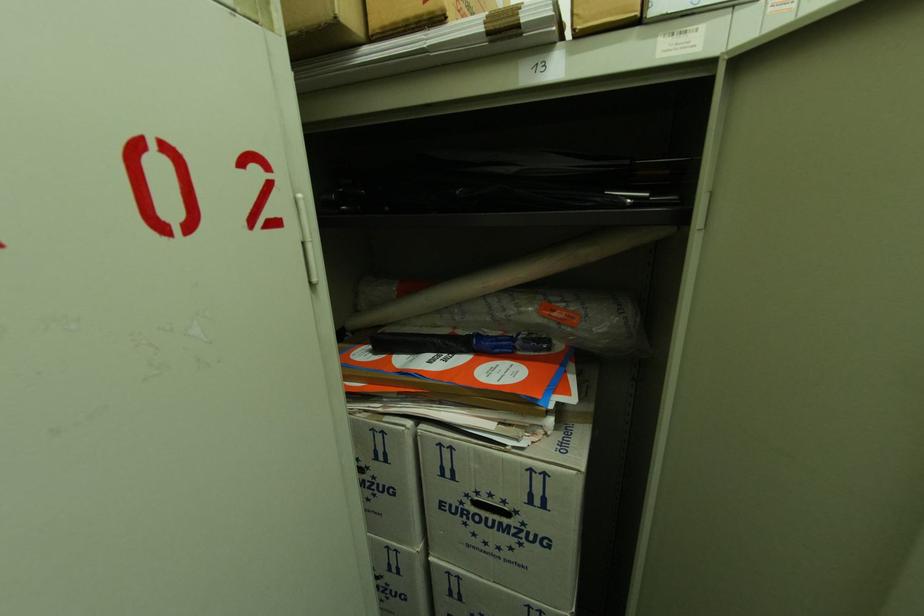
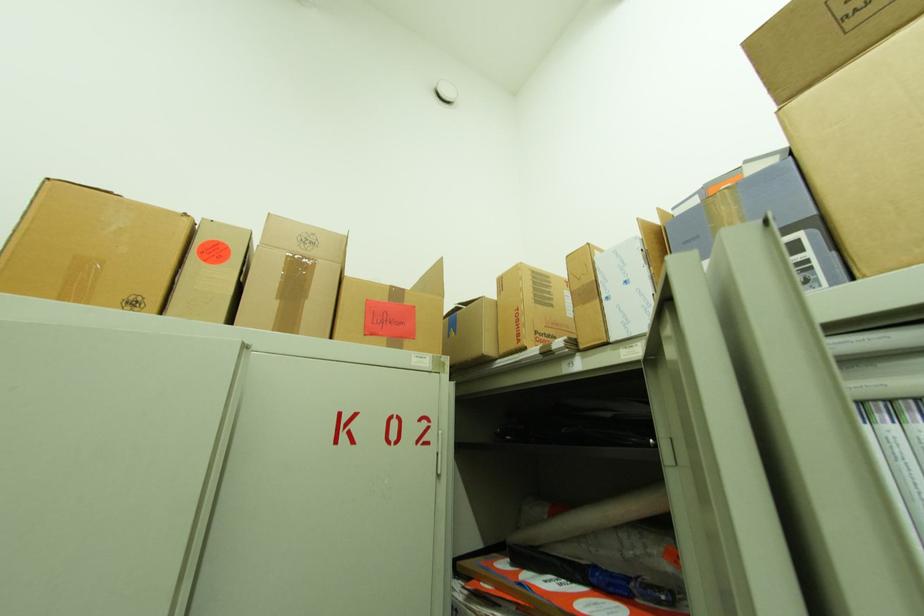
Consider the image. The images are taken continuously from a first-person perspective. In which direction is your viewpoint rotating?

The camera rotated toward left-up.